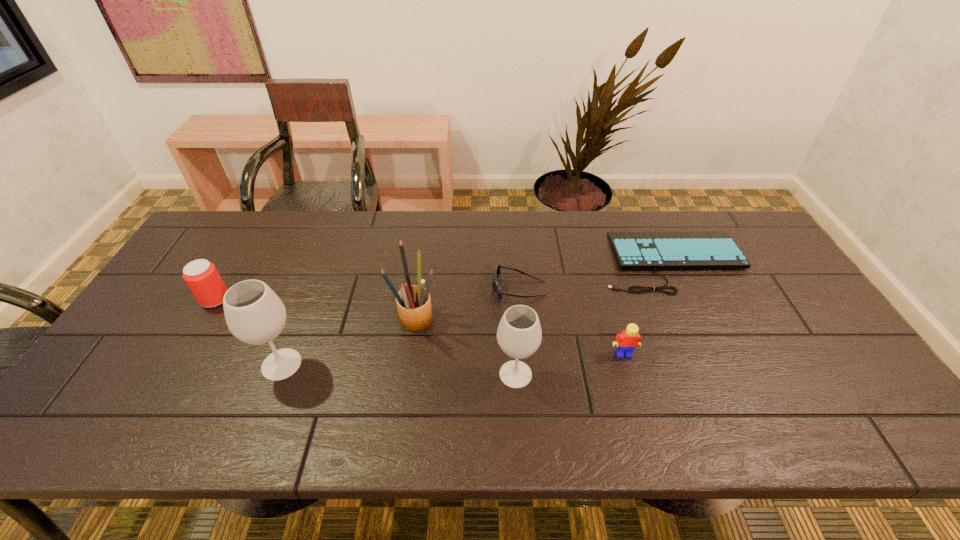
The width and height of the screenshot is (960, 540). Identify the location of object positioned at the far right corner. (705, 249).

In the image, there is a desktop. Where is `free space at the far edge`? free space at the far edge is located at coordinates (483, 228).

At what (x,y) coordinates should I click in order to perform the action: click on vacant space at the near edge. Please return your answer as a coordinate pair (x, y). Looking at the image, I should click on (442, 377).

Find the location of a particular element. Image resolution: width=960 pixels, height=540 pixels. vacant region at the left edge of the desktop is located at coordinates (181, 325).

The height and width of the screenshot is (540, 960). Find the location of `vacant region at the near left corner of the desktop`. vacant region at the near left corner of the desktop is located at coordinates (122, 395).

I want to click on vacant area at the far right corner, so click(x=756, y=248).

Where is `free space between the second shortest object and the computer keyboard`? The height and width of the screenshot is (540, 960). free space between the second shortest object and the computer keyboard is located at coordinates (595, 275).

The width and height of the screenshot is (960, 540). I want to click on empty space that is in between the left wineglass and the Lego, so click(452, 359).

Where is `free space between the pencil box and the shorter wineglass`? The width and height of the screenshot is (960, 540). free space between the pencil box and the shorter wineglass is located at coordinates (466, 347).

Find the location of a particular element. free spot between the sixth object from right to left and the Lego is located at coordinates (452, 359).